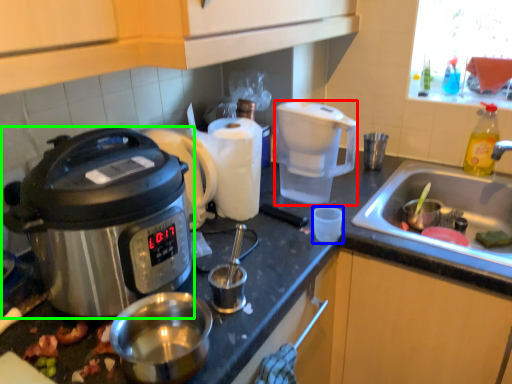
Question: Estimate the real-world distances between objects in this image. Which object is closer to coffee maker (highlighted by a red box), coffee cup (highlighted by a blue box) or slow cooker (highlighted by a green box)?

Choices:
 (A) coffee cup
 (B) slow cooker

Answer: (A)